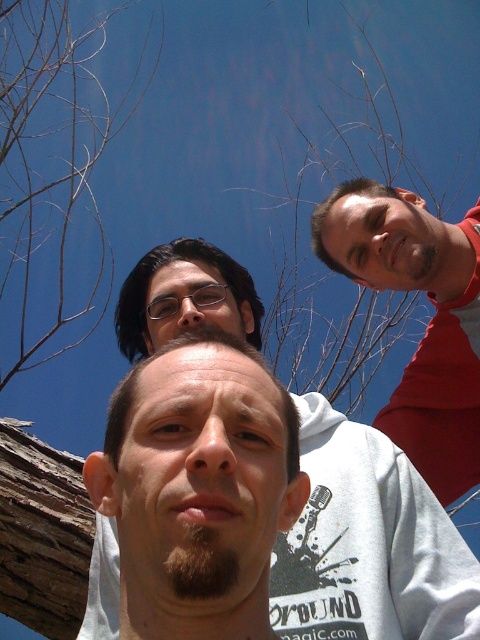
Between light brown hair at center and red matte shirt at upper right, which one has more height?

red matte shirt at upper right

Which is more to the left, light brown hair at center or red matte shirt at upper right?

light brown hair at center is more to the left.

This screenshot has height=640, width=480. Identify the location of light brown hair at center. (197, 488).

The width and height of the screenshot is (480, 640). I want to click on light brown hair at center, so click(x=197, y=488).

Does light brown hair at center have a greater height compared to brownbranch at left?

No, light brown hair at center is not taller than brownbranch at left.

Can you confirm if light brown hair at center is wider than brownbranch at left?

In fact, light brown hair at center might be narrower than brownbranch at left.

Is point (173, 376) more distant than point (33, 48)?

No, (173, 376) is in front of (33, 48).

At what (x,y) coordinates should I click in order to perform the action: click on light brown hair at center. Please return your answer as a coordinate pair (x, y). This screenshot has width=480, height=640. Looking at the image, I should click on (197, 488).

In the scene shown: Does brownbranch at left appear over red matte shirt at upper right?

Indeed, brownbranch at left is positioned over red matte shirt at upper right.

Does brownbranch at left appear under red matte shirt at upper right?

Incorrect, brownbranch at left is not positioned below red matte shirt at upper right.

Between point (59, 291) and point (396, 228), which one is positioned in front?

Point (396, 228)

This screenshot has height=640, width=480. Identify the location of brownbranch at left. (52, 172).